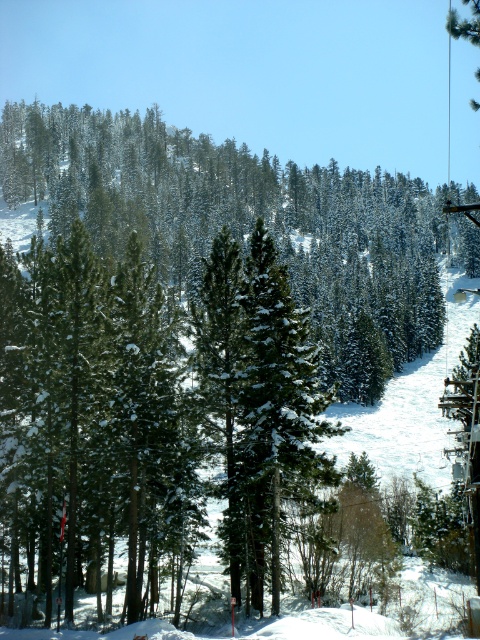
Question: Is green textured pine at center closer to the viewer compared to green matte tree at center?

Choices:
 (A) no
 (B) yes

Answer: (A)

Question: Observing the image, what is the correct spatial positioning of green textured pine at center in reference to green matte tree at center?

Choices:
 (A) left
 (B) right

Answer: (B)

Question: Can you confirm if green textured pine at center is positioned to the left of green matte tree at center?

Choices:
 (A) yes
 (B) no

Answer: (B)

Question: Which point is closer to the camera?

Choices:
 (A) (260, 321)
 (B) (160, 182)

Answer: (A)

Question: Which point appears closest to the camera in this image?

Choices:
 (A) (371, 266)
 (B) (305, 369)

Answer: (B)